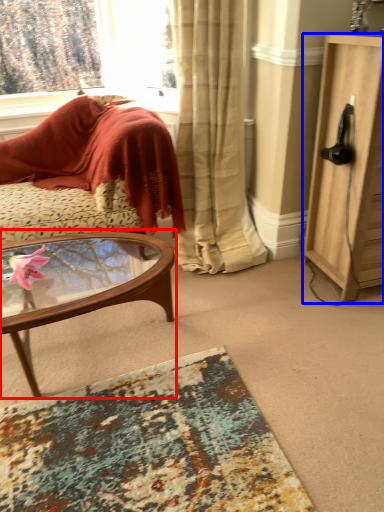
Question: Which object is closer to the camera taking this photo, coffee table (highlighted by a red box) or cabinetry (highlighted by a blue box)?

Choices:
 (A) coffee table
 (B) cabinetry

Answer: (A)